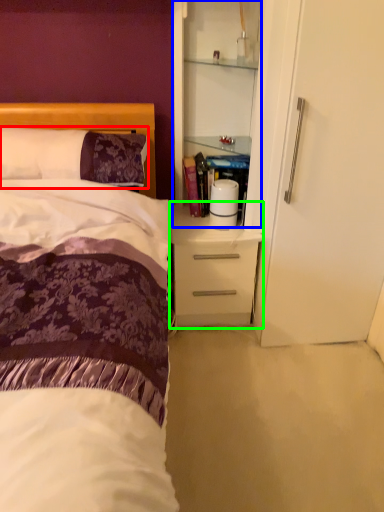
Question: Which object is the farthest from pillow (highlighted by a red box)? Choose among these: cabinetry (highlighted by a blue box) or desk (highlighted by a green box).

Choices:
 (A) cabinetry
 (B) desk

Answer: (B)